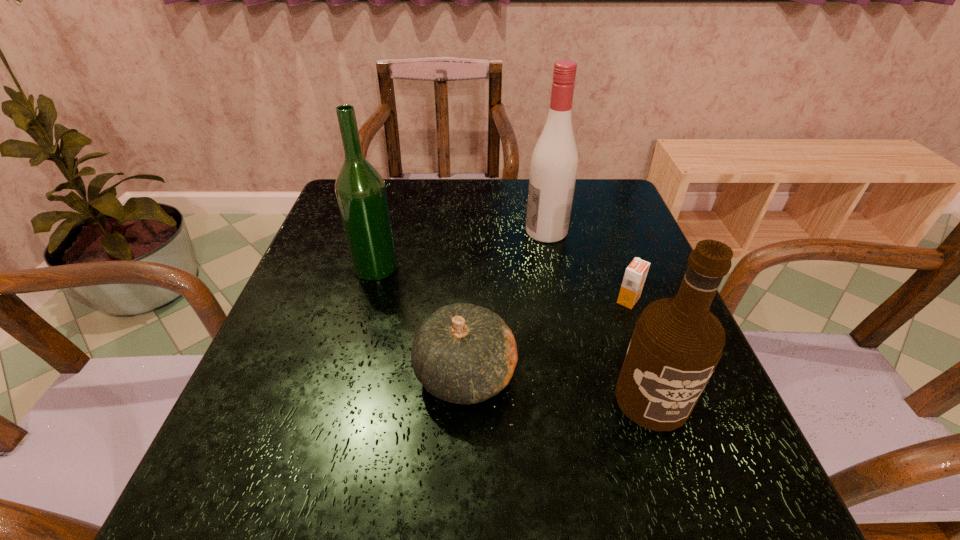
The image size is (960, 540). I want to click on orange juice that is at the right edge, so click(x=635, y=275).

Where is `free space at the far edge of the desktop`? Image resolution: width=960 pixels, height=540 pixels. free space at the far edge of the desktop is located at coordinates (473, 200).

Where is `vacant space at the near edge of the desktop`? The image size is (960, 540). vacant space at the near edge of the desktop is located at coordinates [466, 513].

Where is `vacant region at the left edge of the desktop`? The image size is (960, 540). vacant region at the left edge of the desktop is located at coordinates (346, 330).

Find the location of a particular element. vacant space at the right edge of the desktop is located at coordinates (585, 254).

Where is `vacant area at the near left corner`? vacant area at the near left corner is located at coordinates [x=194, y=506].

You are a GUI agent. You are given a task and a screenshot of the screen. Output one action in this format:
    pyautogui.click(x=<x>, y=<y>)
    Task: Click on the vacant space at the far right corner
    
    Given the screenshot: What is the action you would take?
    pyautogui.click(x=584, y=215)

Where is `vacant point located between the second farthest object and the shortest object`? The image size is (960, 540). vacant point located between the second farthest object and the shortest object is located at coordinates (502, 284).

Where is `free space between the second alcohol from left to right and the second farthest object`? This screenshot has height=540, width=960. free space between the second alcohol from left to right and the second farthest object is located at coordinates (461, 249).

Locate an element on the screen. free space between the farthest alcohol and the second object from left to right is located at coordinates (506, 302).